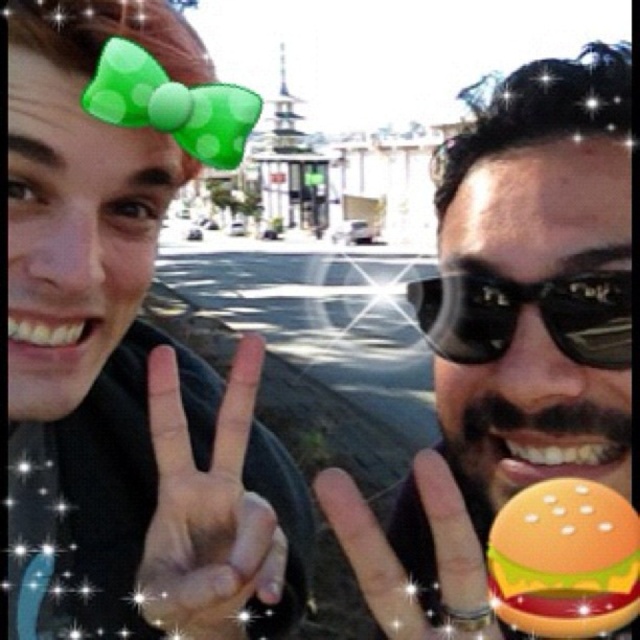
You are a photographer trying to focus on the orange plastic burger at lower right. However, your camera is currently focused on the black matte hand at center. Can you adjust the focus to the burger without moving your camera position?

The black matte hand at center is further to the viewer than orange plastic burger at lower right. Since the hand is closer to you, adjusting focus to the burger behind it might require refocusing, but without moving the camera, it should be possible by changing the focus setting to the burger.

You are a photographer trying to capture the black matte hand at center and the orange plastic burger at lower right in the same frame. Which object is wider?

The black matte hand at center is wider than the orange plastic burger at lower right.

You are taking a photo of two people standing in front of a pagoda. The camera is at point (468, 252). The camera is 62.46 meters away from the people. Will the people be in focus if the camera has a depth of field of 50 meters?

The camera is 62.46 meters away from the people, which is beyond the camera depth of field of 50 meters. Therefore, the people will not be in focus.